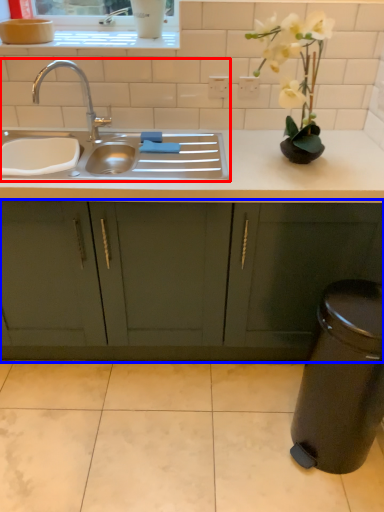
Question: Which point is further to the camera, sink (highlighted by a red box) or cabinetry (highlighted by a blue box)?

Choices:
 (A) sink
 (B) cabinetry

Answer: (B)